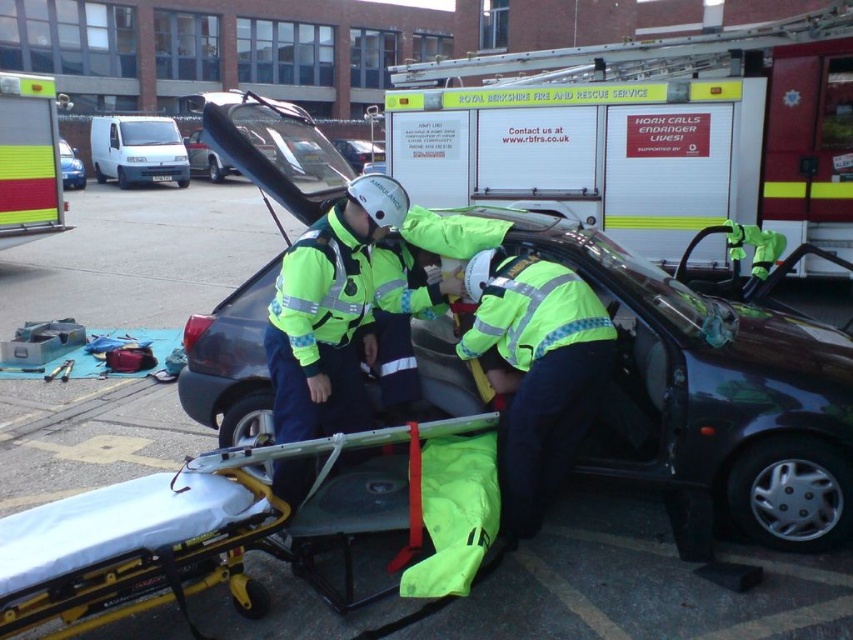
Does neon green fabric at lower right have a greater height compared to white matte van at upper left?

Incorrect, neon green fabric at lower right's height is not larger of white matte van at upper left's.

Where is `neon green fabric at lower right`? neon green fabric at lower right is located at coordinates (537, 371).

Which is behind, point (506, 436) or point (68, 156)?

The point (68, 156) is more distant.

Describe the element at coordinates (537, 371) in the screenshot. I see `neon green fabric at lower right` at that location.

Identify the location of neon green fabric at lower right. The width and height of the screenshot is (853, 640). (537, 371).

Find the location of a particular element. This screenshot has width=853, height=640. yellow reflective ambulance at center is located at coordinates (643, 132).

Find the location of a particular element. yellow reflective ambulance at center is located at coordinates (643, 132).